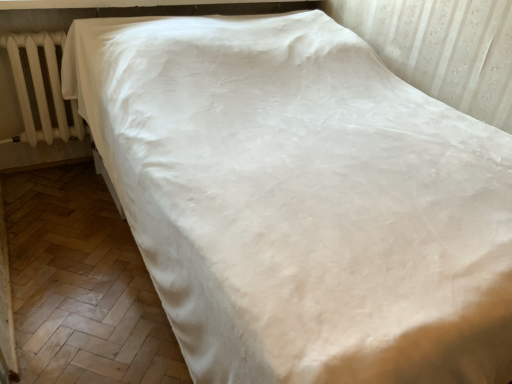
Question: Is white plastic radiator at left at the back of smooth black window sill at upper center?

Choices:
 (A) no
 (B) yes

Answer: (A)

Question: Is smooth black window sill at upper center shorter than white plastic radiator at left?

Choices:
 (A) yes
 (B) no

Answer: (A)

Question: Does smooth black window sill at upper center appear on the left side of white plastic radiator at left?

Choices:
 (A) yes
 (B) no

Answer: (B)

Question: Can you confirm if smooth black window sill at upper center is positioned to the right of white plastic radiator at left?

Choices:
 (A) no
 (B) yes

Answer: (B)

Question: Is the surface of smooth black window sill at upper center in direct contact with white plastic radiator at left?

Choices:
 (A) yes
 (B) no

Answer: (B)

Question: Is smooth black window sill at upper center taller than white plastic radiator at left?

Choices:
 (A) no
 (B) yes

Answer: (A)

Question: Can you confirm if white plastic radiator at left is thinner than smooth black window sill at upper center?

Choices:
 (A) yes
 (B) no

Answer: (A)

Question: Considering the relative positions of white plastic radiator at left and smooth black window sill at upper center in the image provided, is white plastic radiator at left to the right of smooth black window sill at upper center from the viewer's perspective?

Choices:
 (A) yes
 (B) no

Answer: (B)

Question: Is white plastic radiator at left shorter than smooth black window sill at upper center?

Choices:
 (A) yes
 (B) no

Answer: (B)

Question: Is white plastic radiator at left in front of smooth black window sill at upper center?

Choices:
 (A) no
 (B) yes

Answer: (A)

Question: Could smooth black window sill at upper center be considered to be inside white plastic radiator at left?

Choices:
 (A) no
 (B) yes

Answer: (A)

Question: Considering the relative sizes of white plastic radiator at left and smooth black window sill at upper center in the image provided, is white plastic radiator at left bigger than smooth black window sill at upper center?

Choices:
 (A) no
 (B) yes

Answer: (B)

Question: In the image, is white plastic radiator at left positioned in front of or behind smooth black window sill at upper center?

Choices:
 (A) front
 (B) behind

Answer: (B)